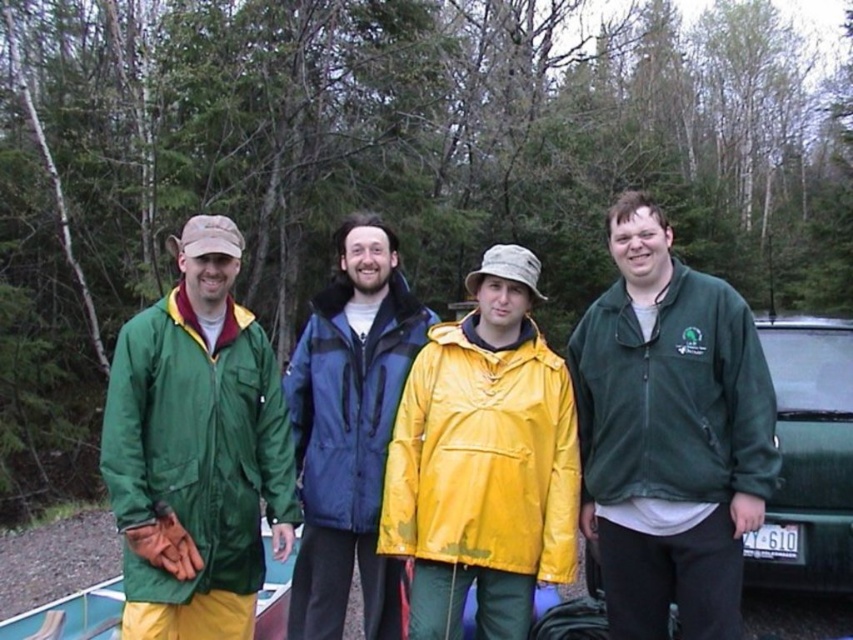
Based on the coordinates given in the Objects Description, which individual is located at the point with the coordinates (196, 445)?

The point at coordinates (196, 445) indicates the location of the green matte jacket at left.